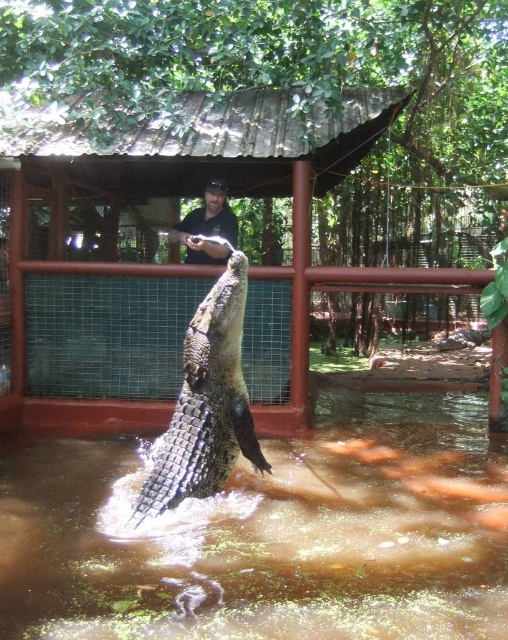
Question: Which is farther from the shiny brown crocodile at center?

Choices:
 (A) brown murky water at center
 (B) black matte shirt at upper center

Answer: (B)

Question: Does brown murky water at center have a greater width compared to shiny brown crocodile at center?

Choices:
 (A) no
 (B) yes

Answer: (B)

Question: Does shiny brown crocodile at center appear under black matte shirt at upper center?

Choices:
 (A) no
 (B) yes

Answer: (B)

Question: Can you confirm if shiny brown crocodile at center is positioned above black matte shirt at upper center?

Choices:
 (A) yes
 (B) no

Answer: (B)

Question: Considering the real-world distances, which object is closest to the shiny brown crocodile at center?

Choices:
 (A) brown murky water at center
 (B) black matte shirt at upper center

Answer: (A)

Question: Which point is farther to the camera?

Choices:
 (A) click(x=213, y=182)
 (B) click(x=269, y=467)
 (C) click(x=480, y=484)

Answer: (A)